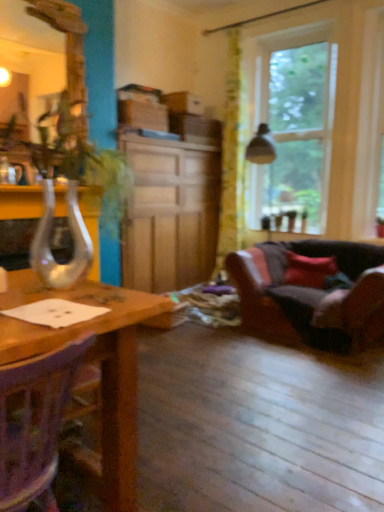
Find the location of a particular element. This screenshot has width=384, height=512. vacant area on top of clear glass window at upper right (from a real-world perspective) is located at coordinates (289, 36).